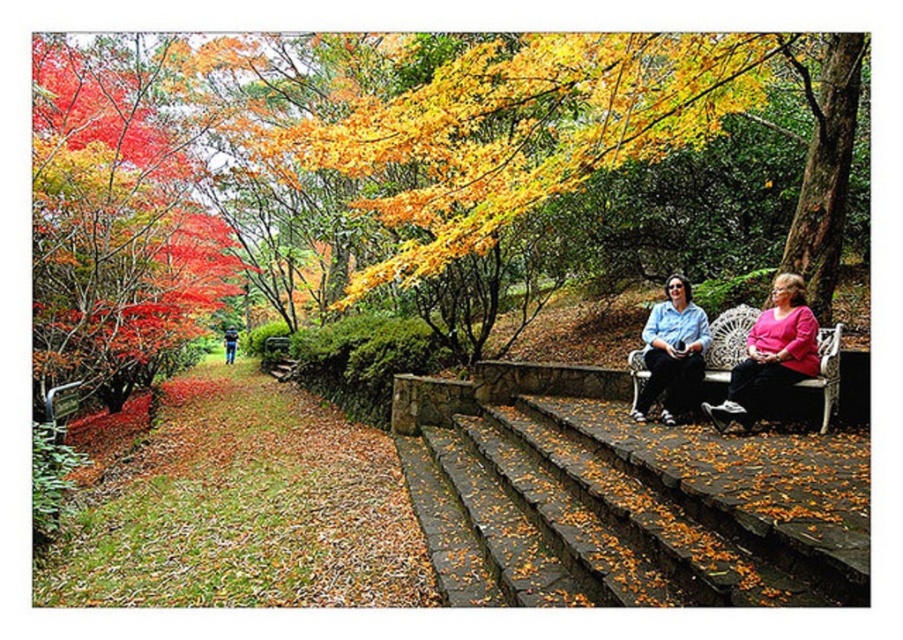
You are a photographer trying to capture a candid shot of the two people sitting on the white bench. You notice the matte pink blouse at center and the blue jeans at lower left in your viewfinder. Based on their heights in the image, which one is more likely to be in the foreground?

The matte pink blouse at center is taller than the blue jeans at lower left, so it is more likely to be in the foreground.

You are a photographer planning to capture a closeup of the matte blue shirt at center and the blue jeans at lower left. Since you want both subjects to be in focus, you need to know which one is wider. Which object is wider?

The matte blue shirt at center is wider than the blue jeans at lower left according to the description.